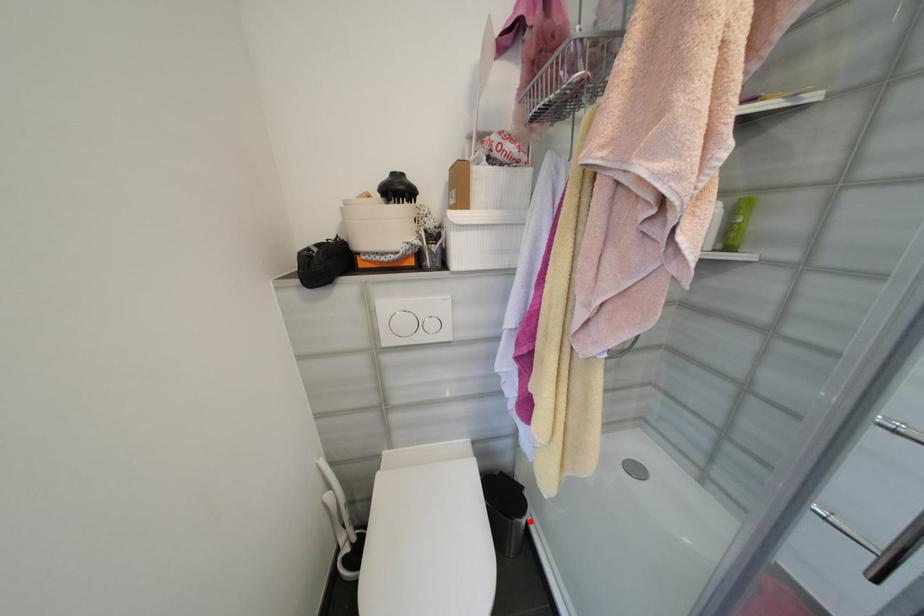
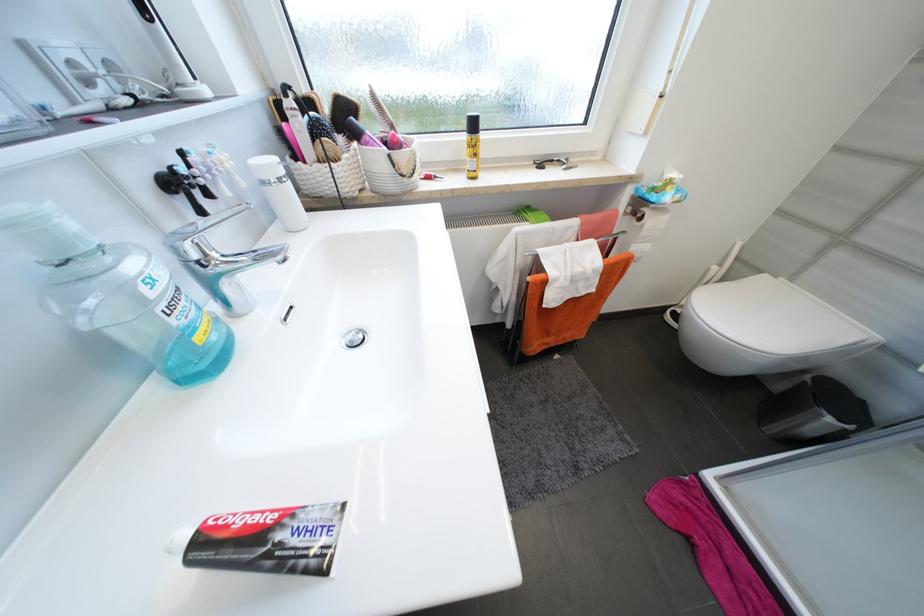
Question: I am providing you with two images of the same scene from different viewpoints. A red point is shown in image1. For the corresponding object point in image2, is it positioned nearer or farther from the camera?

Choices:
 (A) Nearer
 (B) Farther

Answer: (A)